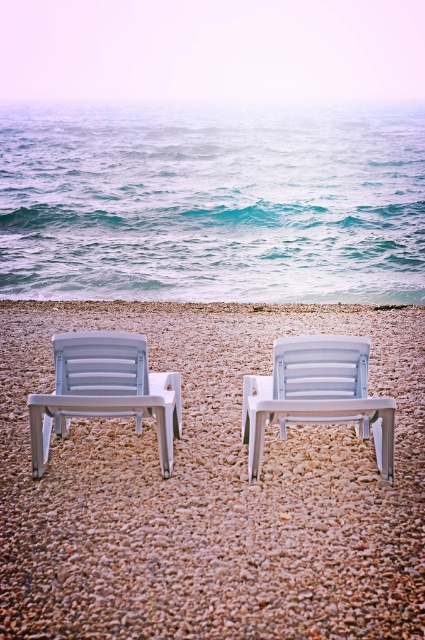
In order to click on white pebbles at center in this screenshot , I will do `click(210, 490)`.

Does white pebbles at center come in front of white plastic beach chair at center?

Yes.

In order to click on white pebbles at center in this screenshot , I will do `click(210, 490)`.

Is blue water at upper center bigger than white plastic beach chair at center?

Correct, blue water at upper center is larger in size than white plastic beach chair at center.

I want to click on blue water at upper center, so click(x=212, y=202).

Find the location of a particular element. Image resolution: width=425 pixels, height=640 pixels. blue water at upper center is located at coordinates coord(212,202).

Is blue water at upper center below white plastic beach chair at left?

No.

Is blue water at upper center positioned at the back of white plastic beach chair at left?

Yes, blue water at upper center is further from the viewer.

Which is behind, point (295, 262) or point (144, 344)?

Positioned behind is point (295, 262).

Find the location of a particular element. The height and width of the screenshot is (640, 425). blue water at upper center is located at coordinates (212, 202).